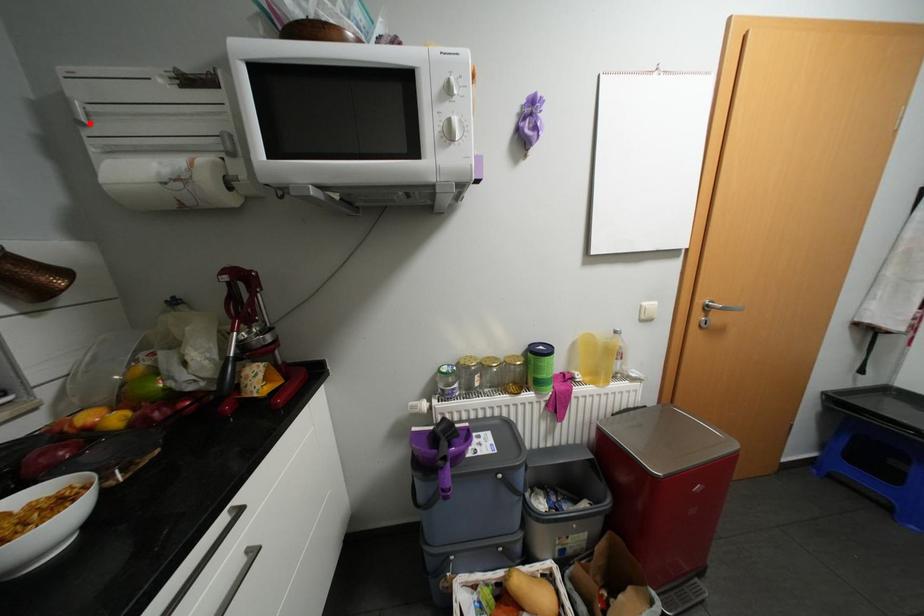
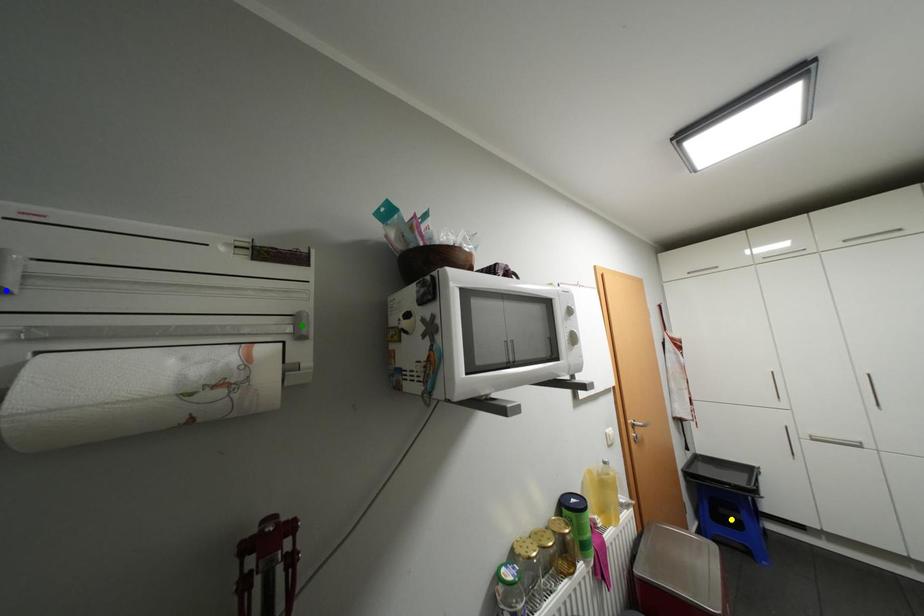
Question: I am providing you with two images of the same scene from different viewpoints. A red point is marked on the first image. You are given multiple points on the second image. In image 2, which mark is for the same physical point as the one in image 1?

Choices:
 (A) blue point
 (B) yellow point
 (C) green point

Answer: (A)